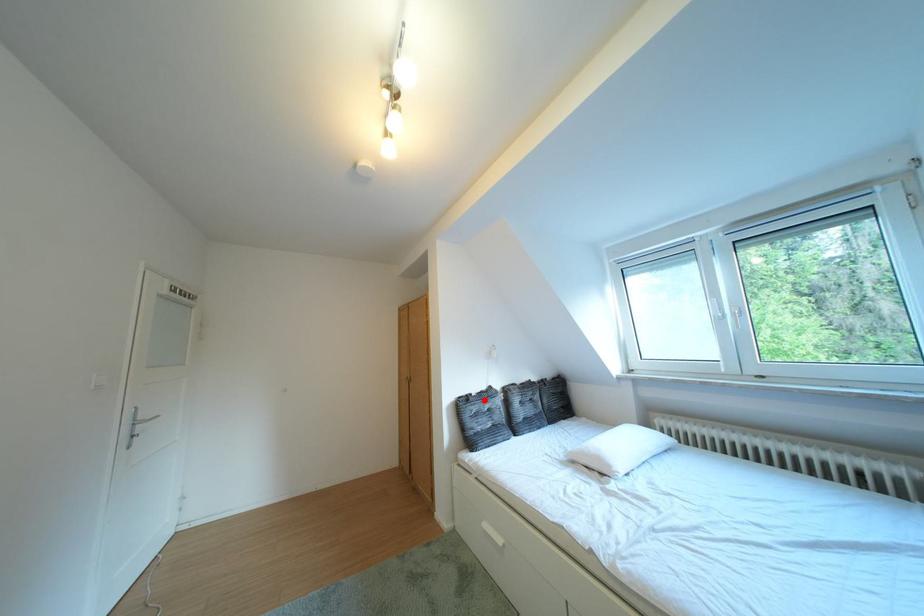
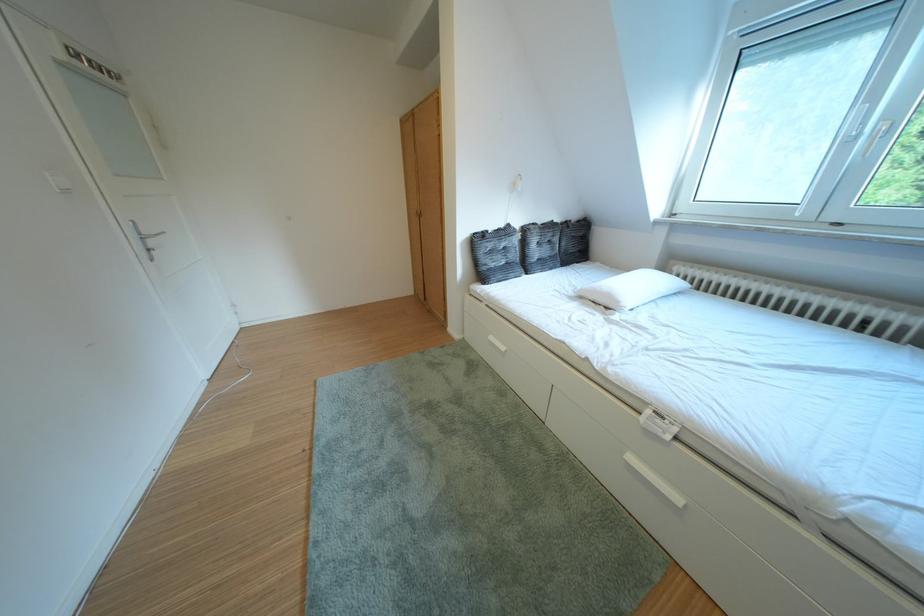
Question: A red point is marked in image1. In image2, is the corresponding 3D point closer to the camera or farther? Reply with the corresponding letter.

Choices:
 (A) The corresponding 3D point is closer.
 (B) The corresponding 3D point is farther.

Answer: (A)